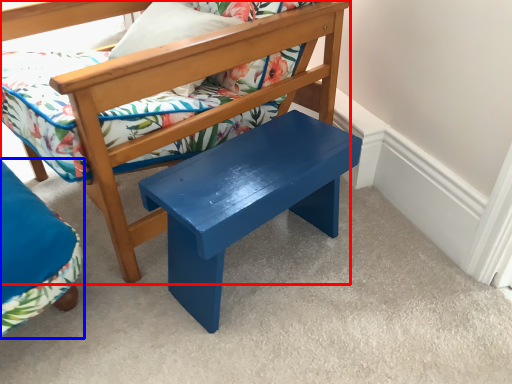
Question: Which point is closer to the camera, chair (highlighted by a red box) or chair (highlighted by a blue box)?

Choices:
 (A) chair
 (B) chair

Answer: (A)